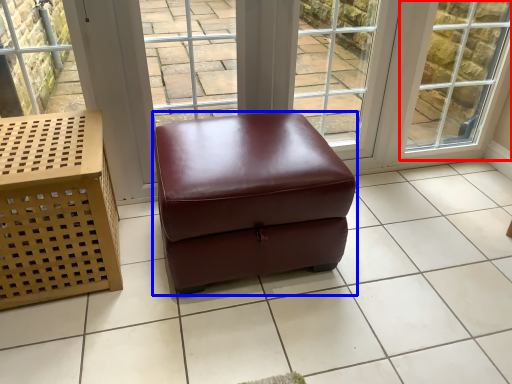
Question: Which of the following is the closest to the observer, window (highlighted by a red box) or stool (highlighted by a blue box)?

Choices:
 (A) window
 (B) stool

Answer: (B)